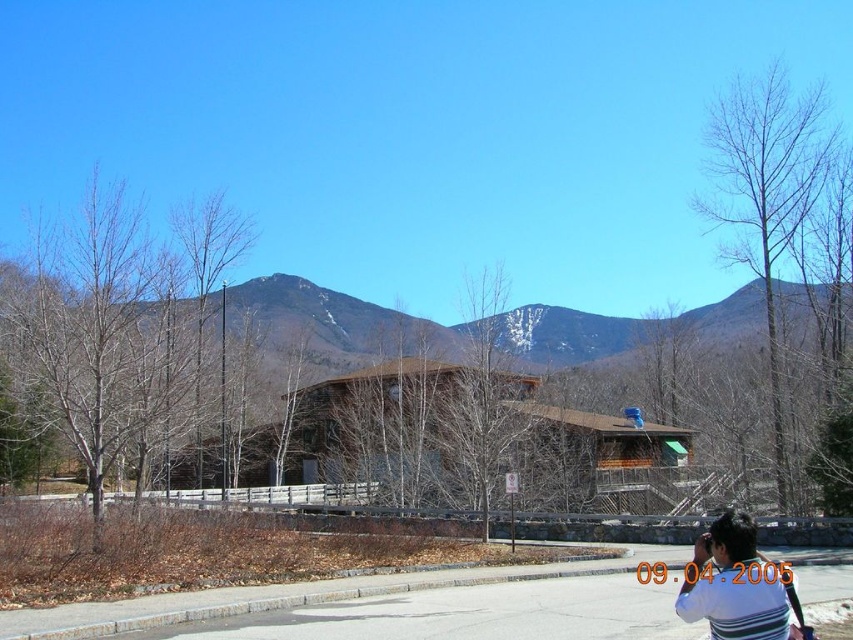
You are a hiker standing at the center of the paved road in front of the rustic wooden building. You see the bare branches at left and the bare wood tree at right. Which one is taller?

The bare wood tree at right is taller than the bare branches at left.

You are standing at the entrance of the rustic wooden building and want to take a photo that includes both the bare branches at left and the snowy brown mountain at center. Which object should you adjust your camera angle to include first if you need to frame both in the same shot?

You should adjust your camera angle to include the bare branches at left first because it is closer to the viewer than the snowy brown mountain at center, so you need to ensure it is positioned properly in the frame before capturing the distant mountain.

You are a hiker planning to take a photo of the distant mountains. You have two options for positioning yourself in front of the bare branches at left and the bare wood tree at right. Which position would allow you to capture the mountains without any obstruction from the trees?

The bare wood tree at right is smaller in size compared to the bare branches at left. Positioning yourself in front of the bare wood tree at right would allow you to capture the distant mountains without obstruction from the trees.